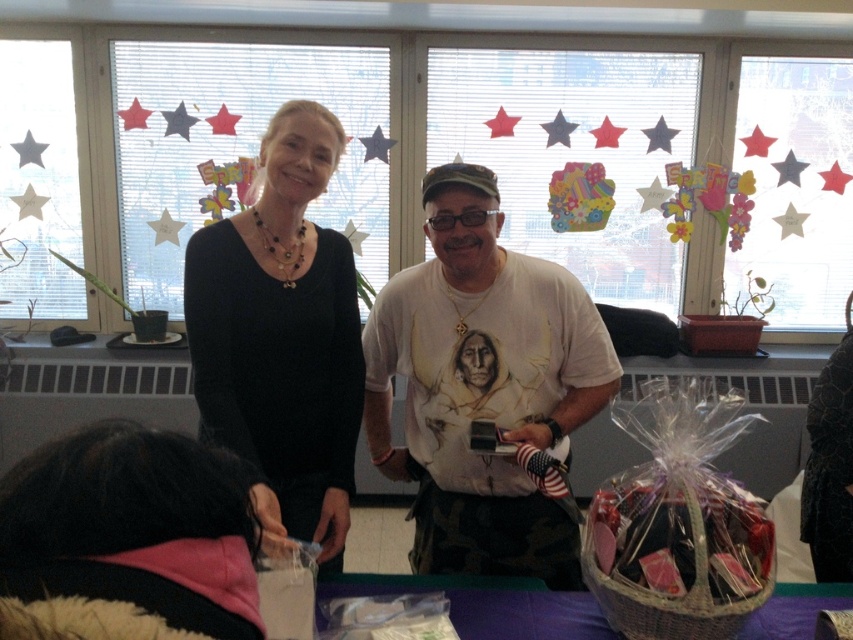
Question: Based on their relative distances, which object is nearer to the pink fleece scarf at lower left?

Choices:
 (A) black matte sweater at upper center
 (B) white t-shirt at center
 (C) purple fabric table at lower center
 (D) matte wicker basket at lower right

Answer: (D)

Question: Can you confirm if white t-shirt at center is positioned below purple fabric table at lower center?

Choices:
 (A) yes
 (B) no

Answer: (B)

Question: Does pink fleece scarf at lower left have a greater width compared to purple fabric table at lower center?

Choices:
 (A) no
 (B) yes

Answer: (A)

Question: Which object is closer to the camera taking this photo?

Choices:
 (A) pink fleece scarf at lower left
 (B) purple fabric table at lower center
 (C) white t-shirt at center
 (D) matte wicker basket at lower right

Answer: (A)

Question: Does white t-shirt at center appear on the left side of pink fleece scarf at lower left?

Choices:
 (A) no
 (B) yes

Answer: (A)

Question: Based on their relative distances, which object is nearer to the matte wicker basket at lower right?

Choices:
 (A) white t-shirt at center
 (B) black matte sweater at upper center
 (C) purple fabric table at lower center

Answer: (C)